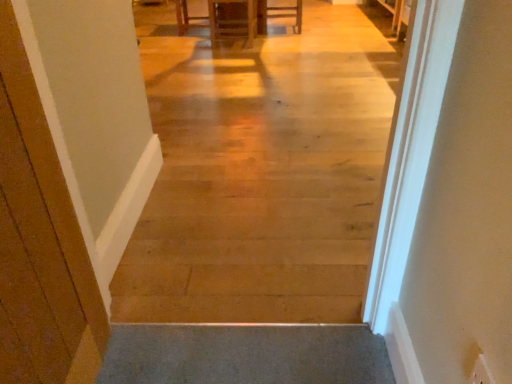
Question: Considering the relative sizes of wooden table at center and matte wooden chair at center, positioned as the first furniture in right-to-left order, in the image provided, is wooden table at center smaller than matte wooden chair at center, positioned as the first furniture in right-to-left order,?

Choices:
 (A) no
 (B) yes

Answer: (A)

Question: Considering the relative sizes of wooden table at center and matte wooden chair at center, positioned as the first furniture in right-to-left order, in the image provided, is wooden table at center bigger than matte wooden chair at center, positioned as the first furniture in right-to-left order,?

Choices:
 (A) no
 (B) yes

Answer: (B)

Question: Is wooden table at center facing towards matte wooden chair at center, which is the 1th furniture from back to front?

Choices:
 (A) no
 (B) yes

Answer: (A)

Question: Is wooden table at center turned away from matte wooden chair at center, positioned as the first furniture in right-to-left order?

Choices:
 (A) no
 (B) yes

Answer: (A)

Question: Considering the relative sizes of wooden table at center and matte wooden chair at center, marked as the 2th furniture in a left-to-right arrangement, in the image provided, is wooden table at center taller than matte wooden chair at center, marked as the 2th furniture in a left-to-right arrangement,?

Choices:
 (A) yes
 (B) no

Answer: (A)

Question: From the image's perspective, is wooden table at center under matte wooden chair at center, marked as the 2th furniture in a left-to-right arrangement?

Choices:
 (A) yes
 (B) no

Answer: (B)

Question: Is wooden table at center placed right next to matte wood cabinet at center, the 2th furniture from the back?

Choices:
 (A) yes
 (B) no

Answer: (B)

Question: Does wooden table at center have a larger size compared to matte wood cabinet at center, the first furniture positioned from the left?

Choices:
 (A) no
 (B) yes

Answer: (B)

Question: Is wooden table at center facing towards matte wood cabinet at center, which is counted as the 2th furniture, starting from the right?

Choices:
 (A) no
 (B) yes

Answer: (A)

Question: From a real-world perspective, is wooden table at center over matte wood cabinet at center, which is counted as the 2th furniture, starting from the right?

Choices:
 (A) no
 (B) yes

Answer: (A)

Question: From a real-world perspective, is wooden table at center located beneath matte wood cabinet at center, the first furniture in the front-to-back sequence?

Choices:
 (A) no
 (B) yes

Answer: (B)

Question: Is wooden table at center smaller than matte wood cabinet at center, the 2th furniture from the back?

Choices:
 (A) yes
 (B) no

Answer: (B)

Question: From the image's perspective, does matte wood cabinet at center, which is counted as the 2th furniture, starting from the right, appear higher than matte wooden chair at center, positioned as the first furniture in right-to-left order?

Choices:
 (A) yes
 (B) no

Answer: (B)